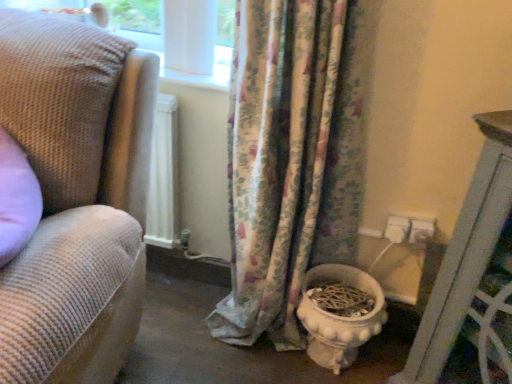
Question: Does floral fabric curtain at center have a lesser width compared to woven fabric couch at left?

Choices:
 (A) no
 (B) yes

Answer: (B)

Question: Does floral fabric curtain at center have a greater height compared to woven fabric couch at left?

Choices:
 (A) yes
 (B) no

Answer: (A)

Question: Is floral fabric curtain at center to the right of woven fabric couch at left from the viewer's perspective?

Choices:
 (A) no
 (B) yes

Answer: (B)

Question: From a real-world perspective, is floral fabric curtain at center below woven fabric couch at left?

Choices:
 (A) yes
 (B) no

Answer: (B)

Question: Is the position of floral fabric curtain at center more distant than that of woven fabric couch at left?

Choices:
 (A) yes
 (B) no

Answer: (A)

Question: From the image's perspective, is white glossy toilet bowl at lower center above or below floral fabric curtain at center?

Choices:
 (A) below
 (B) above

Answer: (A)

Question: In terms of size, does white glossy toilet bowl at lower center appear bigger or smaller than floral fabric curtain at center?

Choices:
 (A) small
 (B) big

Answer: (A)

Question: Which is correct: white glossy toilet bowl at lower center is inside floral fabric curtain at center, or outside of it?

Choices:
 (A) inside
 (B) outside

Answer: (A)

Question: Is point (354, 344) positioned closer to the camera than point (281, 188)?

Choices:
 (A) closer
 (B) farther

Answer: (B)

Question: Considering the relative positions of floral fabric curtain at center and white glossy toilet bowl at lower center in the image provided, is floral fabric curtain at center to the left or to the right of white glossy toilet bowl at lower center?

Choices:
 (A) right
 (B) left

Answer: (B)

Question: Is floral fabric curtain at center in front of or behind white glossy toilet bowl at lower center in the image?

Choices:
 (A) behind
 (B) front

Answer: (B)

Question: Do you think floral fabric curtain at center is within white glossy toilet bowl at lower center, or outside of it?

Choices:
 (A) inside
 (B) outside

Answer: (B)

Question: Considering the positions of floral fabric curtain at center and white glossy toilet bowl at lower center in the image, is floral fabric curtain at center taller or shorter than white glossy toilet bowl at lower center?

Choices:
 (A) short
 (B) tall

Answer: (B)

Question: Does point (350, 281) appear closer or farther from the camera than point (89, 99)?

Choices:
 (A) farther
 (B) closer

Answer: (A)

Question: From the image's perspective, is white glossy toilet bowl at lower center located above or below woven fabric couch at left?

Choices:
 (A) below
 (B) above

Answer: (A)